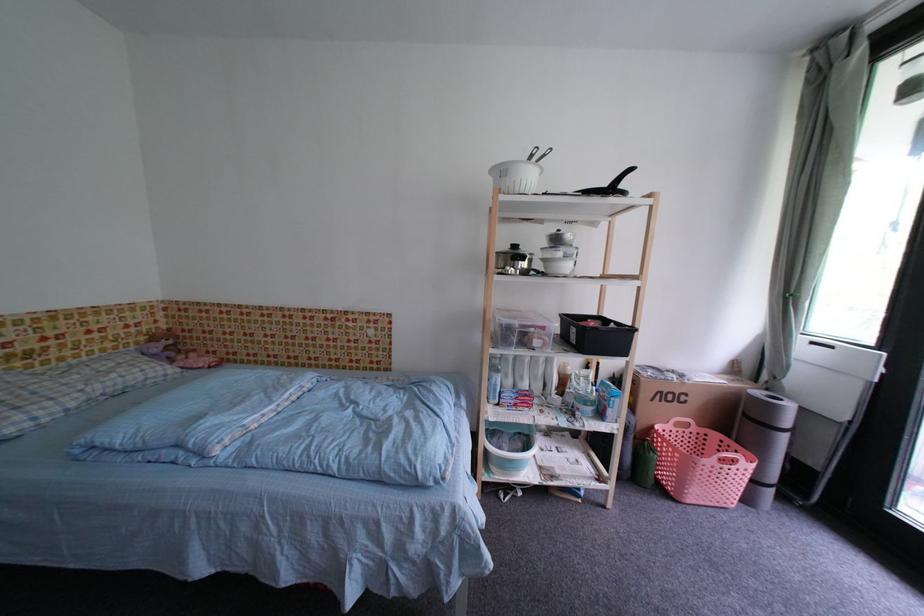
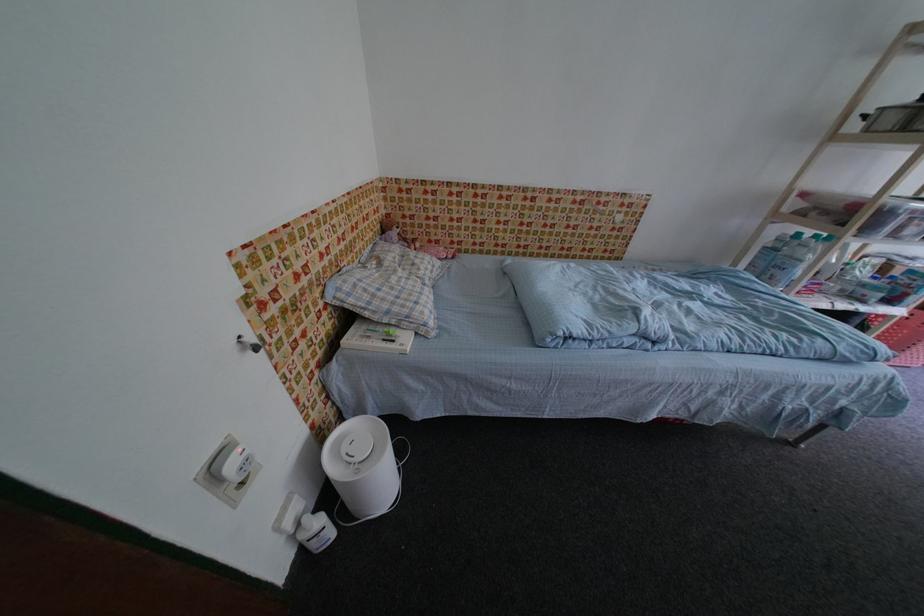
In the second image, find the point that corresponds to (x=78, y=355) in the first image.

(370, 246)